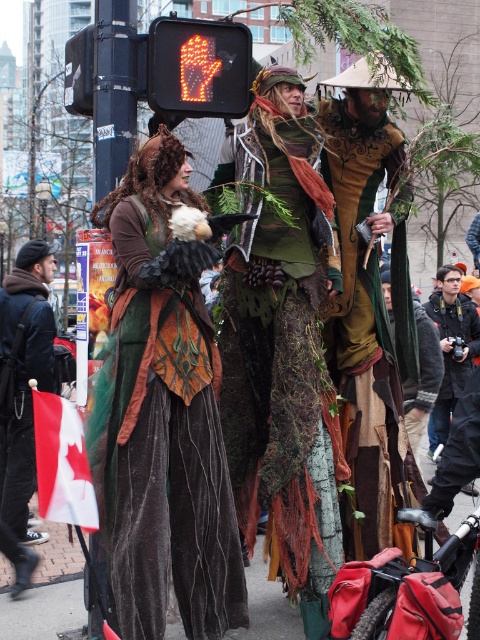
Question: Among these objects, which one is farthest from the camera?

Choices:
 (A) velvet/green dress at center
 (B) matte black camera at right
 (C) orange led hand at upper center

Answer: (B)

Question: Which object is positioned farthest from the matte black camera at right?

Choices:
 (A) green textured fabric at center
 (B) orange led hand at upper center
 (C) velvet/green dress at center
 (D) green velvet dress at center

Answer: (C)

Question: Is velvet/green dress at center smaller than green textured fabric at center?

Choices:
 (A) yes
 (B) no

Answer: (A)

Question: Which point is closer to the camera?

Choices:
 (A) (261, 342)
 (B) (233, 561)
 (C) (225, 67)

Answer: (B)

Question: Does velvet/green dress at center appear on the left side of green textured fabric at center?

Choices:
 (A) yes
 (B) no

Answer: (A)

Question: Can you confirm if green textured fabric at center is positioned to the right of orange led hand at upper center?

Choices:
 (A) yes
 (B) no

Answer: (A)